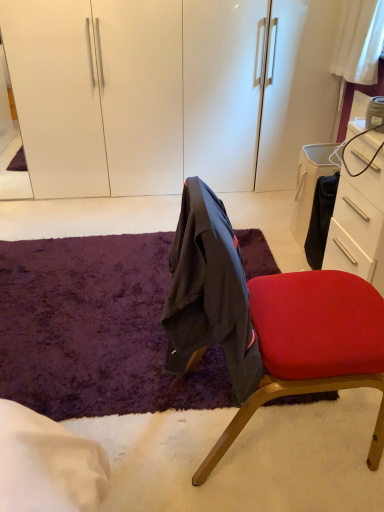
Question: Considering the relative sizes of purple shaggy rug at center and white glossy drawer at right in the image provided, is purple shaggy rug at center shorter than white glossy drawer at right?

Choices:
 (A) yes
 (B) no

Answer: (A)

Question: Is purple shaggy rug at center to the left of white glossy drawer at right from the viewer's perspective?

Choices:
 (A) no
 (B) yes

Answer: (B)

Question: Considering the relative sizes of purple shaggy rug at center and white glossy drawer at right in the image provided, is purple shaggy rug at center bigger than white glossy drawer at right?

Choices:
 (A) no
 (B) yes

Answer: (A)

Question: Is purple shaggy rug at center turned away from white glossy drawer at right?

Choices:
 (A) yes
 (B) no

Answer: (B)

Question: From a real-world perspective, is purple shaggy rug at center under white glossy drawer at right?

Choices:
 (A) no
 (B) yes

Answer: (B)

Question: Can we say purple shaggy rug at center lies outside white glossy drawer at right?

Choices:
 (A) yes
 (B) no

Answer: (A)

Question: Does velvet red chair at center have a lesser height compared to purple shaggy rug at center?

Choices:
 (A) yes
 (B) no

Answer: (B)

Question: From a real-world perspective, is velvet red chair at center positioned under purple shaggy rug at center based on gravity?

Choices:
 (A) yes
 (B) no

Answer: (B)

Question: Would you say velvet red chair at center is a long distance from purple shaggy rug at center?

Choices:
 (A) yes
 (B) no

Answer: (B)

Question: Could you tell me if velvet red chair at center is turned towards purple shaggy rug at center?

Choices:
 (A) yes
 (B) no

Answer: (B)

Question: Is the depth of velvet red chair at center less than that of purple shaggy rug at center?

Choices:
 (A) yes
 (B) no

Answer: (A)

Question: Is the position of velvet red chair at center more distant than that of purple shaggy rug at center?

Choices:
 (A) no
 (B) yes

Answer: (A)

Question: Is white glossy drawer at right taller than purple shaggy rug at center?

Choices:
 (A) no
 (B) yes

Answer: (B)